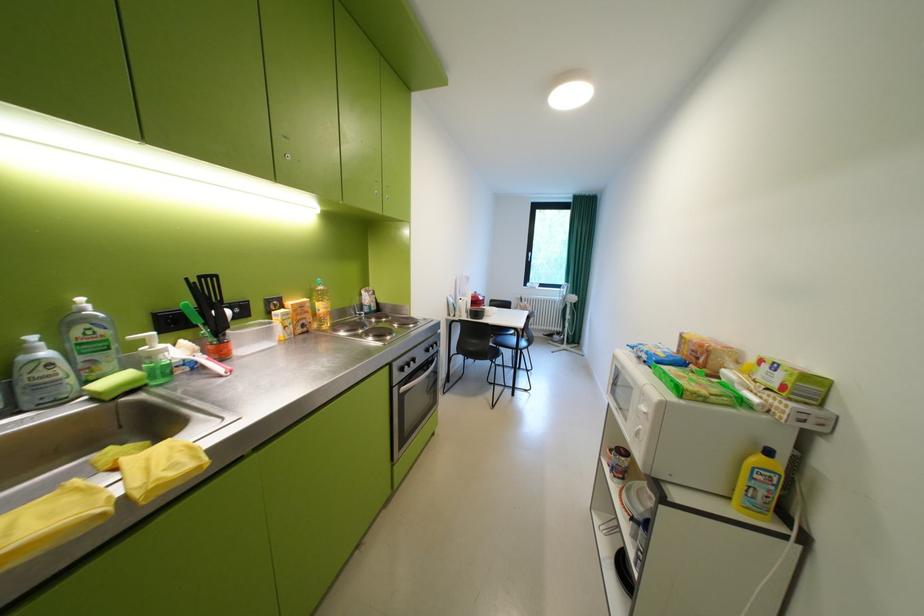
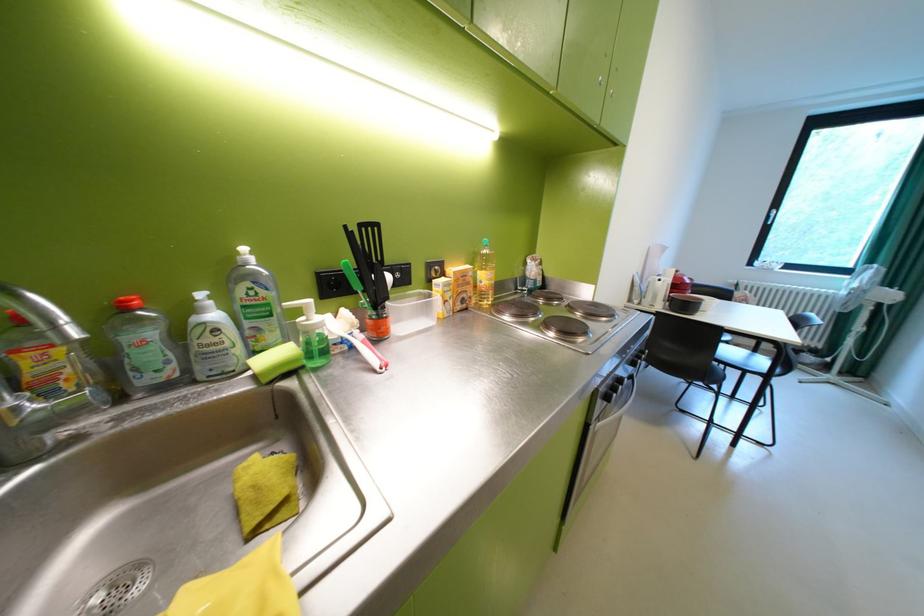
In a continuous first-person perspective shot, in which direction is the camera moving?

The cameraman moved toward left, forward.